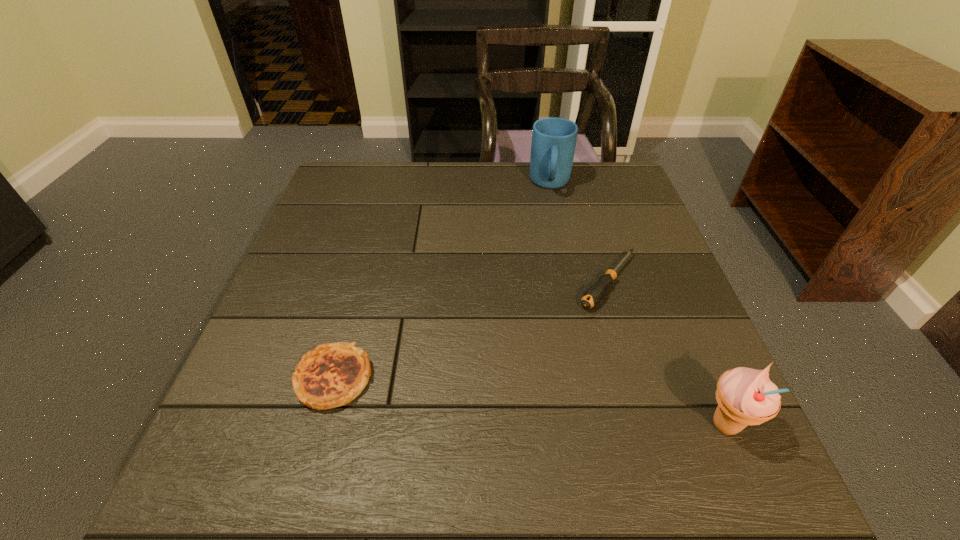
Locate an element on the screen. This screenshot has height=540, width=960. blank area in the image that satisfies the following two spatial constraints: 1. on the back side of the leftmost object; 2. on the left side of the farthest object is located at coordinates (388, 184).